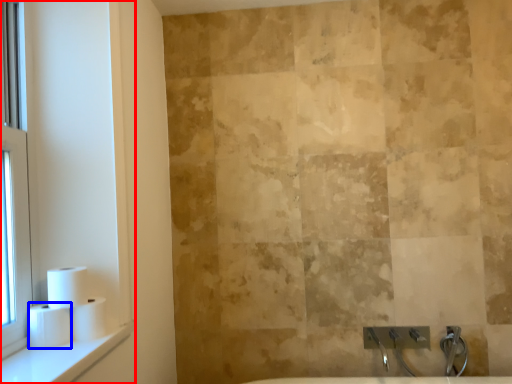
Question: Which object appears closest to the camera in this image, window frame (highlighted by a red box) or toilet paper (highlighted by a blue box)?

Choices:
 (A) window frame
 (B) toilet paper

Answer: (A)